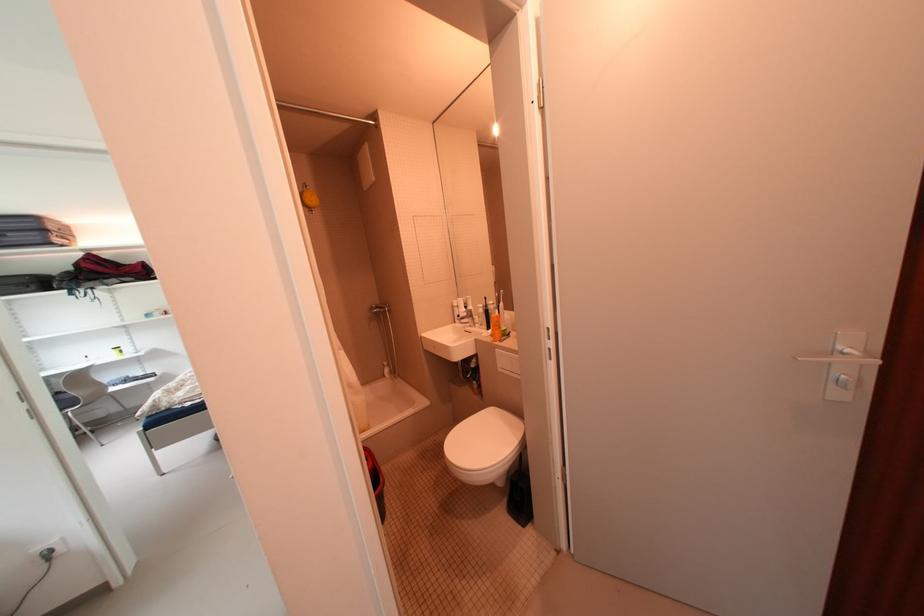
Identify the location of white soap dispenser. (x=502, y=314).